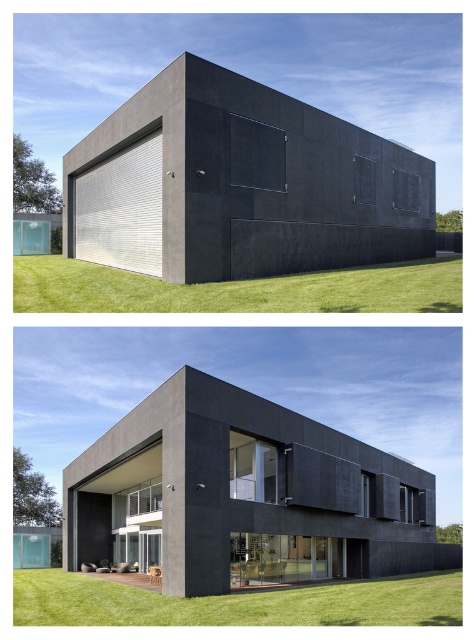
Question: Which point is closer to the camera?

Choices:
 (A) matte black wall at center
 (B) matte black house at center

Answer: (B)

Question: Is matte black wall at center positioned before matte black house at center?

Choices:
 (A) no
 (B) yes

Answer: (A)

Question: Does matte black wall at center have a lesser width compared to matte black house at center?

Choices:
 (A) yes
 (B) no

Answer: (A)

Question: Which object is farther from the camera taking this photo?

Choices:
 (A) matte black wall at center
 (B) matte black house at center

Answer: (A)

Question: Does matte black wall at center come in front of matte black house at center?

Choices:
 (A) no
 (B) yes

Answer: (A)